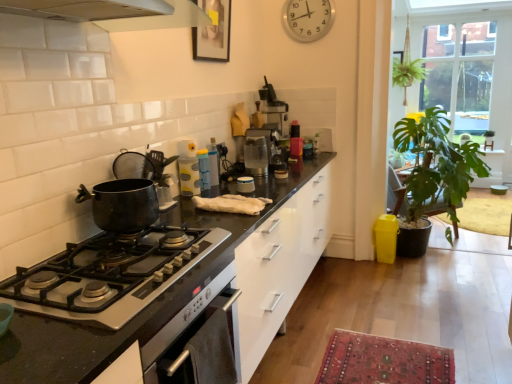
Question: Does clear glass window at upper right have a lesser width compared to silver metallic clock at upper center?

Choices:
 (A) yes
 (B) no

Answer: (B)

Question: Is the depth of clear glass window at upper right greater than that of silver metallic clock at upper center?

Choices:
 (A) yes
 (B) no

Answer: (A)

Question: Is there a large distance between clear glass window at upper right and silver metallic clock at upper center?

Choices:
 (A) yes
 (B) no

Answer: (A)

Question: From the image's perspective, is clear glass window at upper right above silver metallic clock at upper center?

Choices:
 (A) yes
 (B) no

Answer: (A)

Question: Is clear glass window at upper right outside of silver metallic clock at upper center?

Choices:
 (A) yes
 (B) no

Answer: (A)

Question: Is clear glass window at upper right positioned before silver metallic clock at upper center?

Choices:
 (A) yes
 (B) no

Answer: (B)

Question: Would you say silver metallic clock at upper center is outside translucent plastic container at center, which is the third appliance in front-to-back order?

Choices:
 (A) yes
 (B) no

Answer: (A)

Question: Are silver metallic clock at upper center and translucent plastic container at center, the 2th appliance when ordered from back to front, far apart?

Choices:
 (A) no
 (B) yes

Answer: (B)

Question: Does silver metallic clock at upper center contain translucent plastic container at center, marked as the third appliance in a right-to-left arrangement?

Choices:
 (A) no
 (B) yes

Answer: (A)

Question: Can you confirm if silver metallic clock at upper center is taller than translucent plastic container at center, the 2th appliance when ordered from back to front?

Choices:
 (A) yes
 (B) no

Answer: (A)

Question: Does silver metallic clock at upper center have a lesser width compared to translucent plastic container at center, marked as the third appliance in a right-to-left arrangement?

Choices:
 (A) yes
 (B) no

Answer: (A)

Question: From a real-world perspective, is silver metallic clock at upper center positioned over translucent plastic container at center, marked as the third appliance in a right-to-left arrangement, based on gravity?

Choices:
 (A) yes
 (B) no

Answer: (A)

Question: Is clear glass coffee machine at center bigger than green leafy plant at right?

Choices:
 (A) yes
 (B) no

Answer: (B)